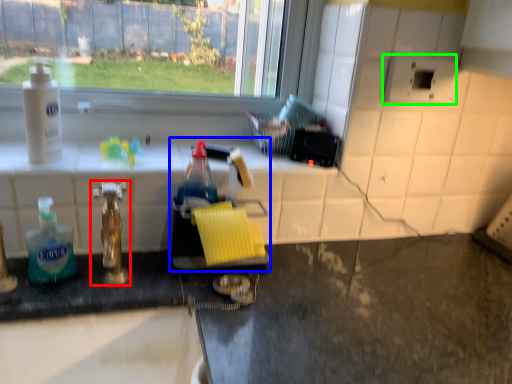
Question: Based on their relative distances, which object is nearer to tap (highlighted by a red box)? Choose from sink (highlighted by a blue box) and appliance (highlighted by a green box).

Choices:
 (A) sink
 (B) appliance

Answer: (A)